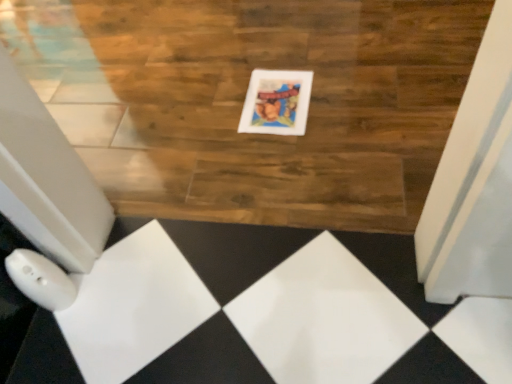
This screenshot has width=512, height=384. Find the location of `free space that is to the left of white glossy picture frame at center`. free space that is to the left of white glossy picture frame at center is located at coordinates (209, 112).